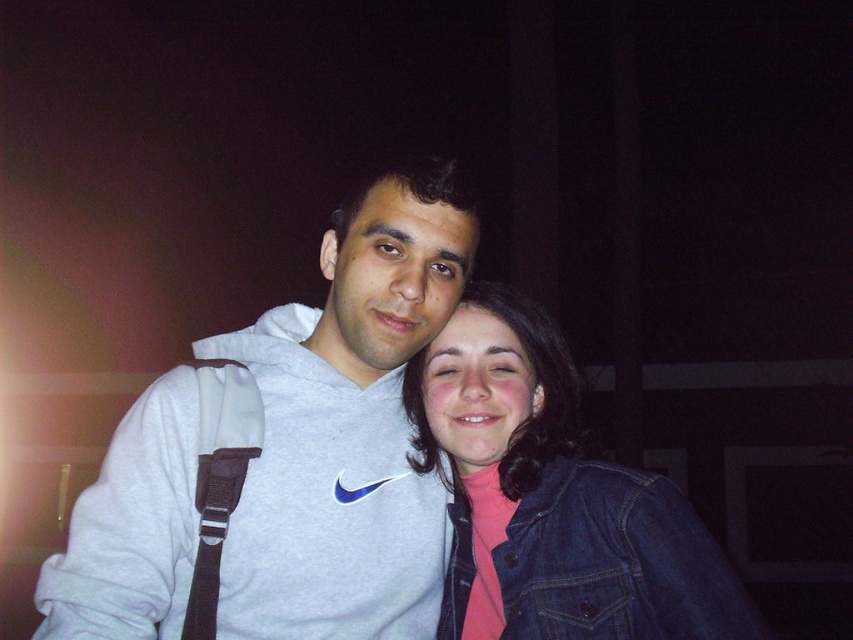
Question: Considering the relative positions of gray sweatshirt at center and denim jacket at lower right in the image provided, where is gray sweatshirt at center located with respect to denim jacket at lower right?

Choices:
 (A) right
 (B) left

Answer: (B)

Question: Among these objects, which one is farthest from the camera?

Choices:
 (A) gray sweatshirt at center
 (B) denim jacket at lower right

Answer: (B)

Question: Can you confirm if gray sweatshirt at center is positioned below denim jacket at lower right?

Choices:
 (A) yes
 (B) no

Answer: (B)

Question: Which point is closer to the camera?

Choices:
 (A) gray sweatshirt at center
 (B) denim jacket at lower right

Answer: (A)

Question: Is gray sweatshirt at center positioned at the back of denim jacket at lower right?

Choices:
 (A) no
 (B) yes

Answer: (A)